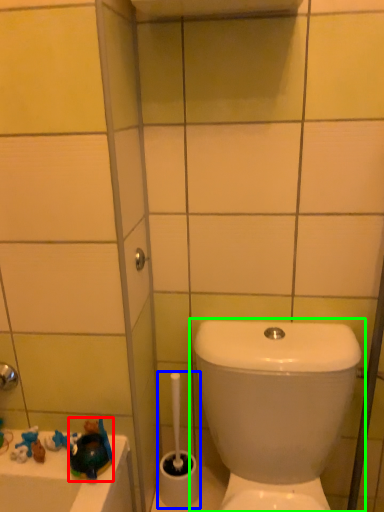
Question: Based on their relative distances, which object is nearer to toy (highlighted by a red box)? Choose from brush (highlighted by a blue box) and toilet (highlighted by a green box).

Choices:
 (A) brush
 (B) toilet

Answer: (A)